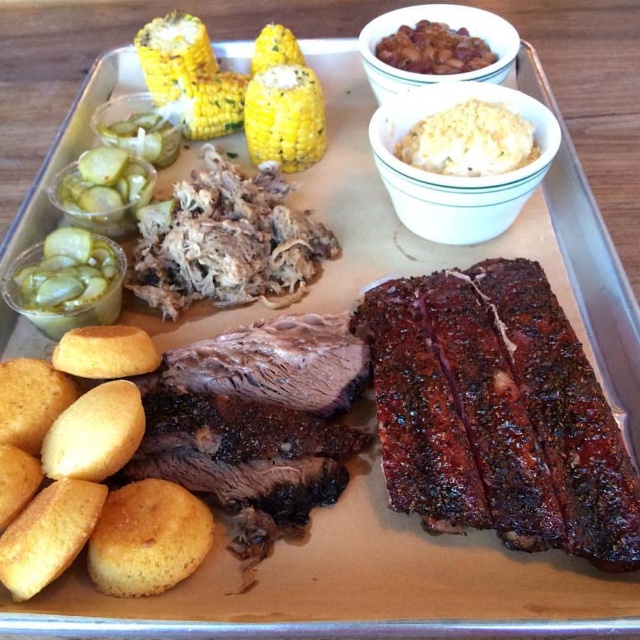
You are a food delivery person who needs to place a divider between the brown textured beans at upper center and the brown glossy beans at upper center to prevent them from mixing. The divider you have is 1.5 inches wide. Will the divider fit between them?

The distance between the brown textured beans at upper center and the brown glossy beans at upper center is 1.64 inches. Since the divider is 1.5 inches wide, it will fit between them as the space is slightly larger than the divider.

You are a food critic analyzing the barbecue meal on the rectangular metal tray. You need to locate the brown glossy beans at upper center. Based on the coordinates provided, can you determine their exact location on the tray?

The brown glossy beans at upper center are located at coordinates point (433, 49) on the tray.